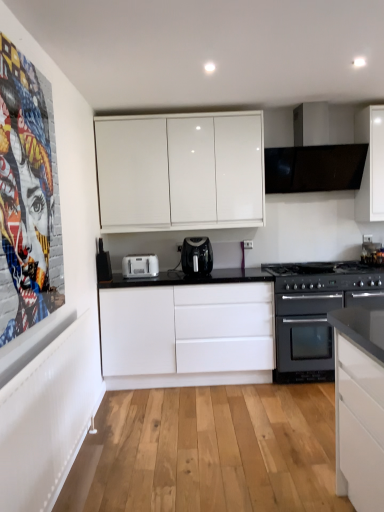
This screenshot has width=384, height=512. In order to click on empty space that is ontop of black matte exhaust hood at upper right (from a real-world perspective) in this screenshot , I will do `click(304, 103)`.